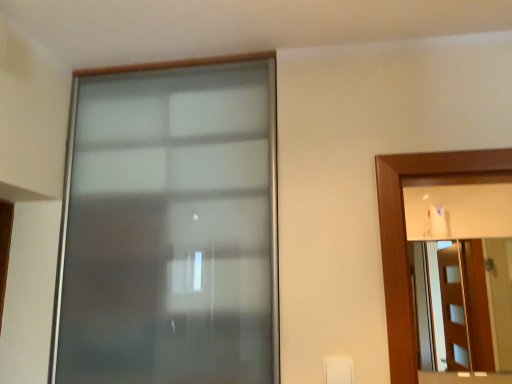
The height and width of the screenshot is (384, 512). Describe the element at coordinates (464, 269) in the screenshot. I see `frosted glass mirror at right` at that location.

What is the approximate height of frosted glass mirror at right?

25.23 inches.

Image resolution: width=512 pixels, height=384 pixels. In order to click on frosted glass mirror at right in this screenshot , I will do `click(464, 269)`.

Image resolution: width=512 pixels, height=384 pixels. Describe the element at coordinates (170, 226) in the screenshot. I see `frosted glass window at center` at that location.

Identify the location of frosted glass window at center. (170, 226).

Where is `frosted glass mirror at right`? The width and height of the screenshot is (512, 384). frosted glass mirror at right is located at coordinates [x=464, y=269].

Considering the relative positions of frosted glass mirror at right and frosted glass window at center in the image provided, is frosted glass mirror at right to the left of frosted glass window at center from the viewer's perspective?

No, frosted glass mirror at right is not to the left of frosted glass window at center.

Based on the photo, does frosted glass mirror at right lie in front of frosted glass window at center?

No, the depth of frosted glass mirror at right is greater than that of frosted glass window at center.

Is point (490, 257) closer to camera compared to point (236, 346)?

No, (490, 257) is further to viewer.

From the image's perspective, is frosted glass mirror at right under frosted glass window at center?

Yes.

From a real-world perspective, which is physically above, frosted glass mirror at right or frosted glass window at center?

frosted glass window at center, from a real-world perspective.

From the picture: Can you confirm if frosted glass mirror at right is thinner than frosted glass window at center?

No.

Is frosted glass mirror at right taller or shorter than frosted glass window at center?

Considering their sizes, frosted glass mirror at right has less height than frosted glass window at center.

Between frosted glass mirror at right and frosted glass window at center, which one has smaller size?

With smaller size is frosted glass mirror at right.

Is frosted glass mirror at right surrounding frosted glass window at center?

No, frosted glass window at center is not inside frosted glass mirror at right.

Are frosted glass mirror at right and frosted glass window at center far apart?

Indeed, frosted glass mirror at right is not near frosted glass window at center.

Is frosted glass mirror at right positioned with its back to frosted glass window at center?

No, frosted glass window at center is not at the back of frosted glass mirror at right.

In the scene shown: How many degrees apart are the facing directions of frosted glass mirror at right and frosted glass window at center?

0.000586 degrees separate the facing orientations of frosted glass mirror at right and frosted glass window at center.

How far apart are frosted glass mirror at right and frosted glass window at center?

They are 7.72 feet apart.

Image resolution: width=512 pixels, height=384 pixels. In order to click on mirror lying on the right of frosted glass window at center in this screenshot , I will do `click(464, 269)`.

Is frosted glass window at center at the right side of frosted glass mirror at right?

Incorrect, frosted glass window at center is not on the right side of frosted glass mirror at right.

Is frosted glass window at center positioned behind frosted glass mirror at right?

No, it is not.

Is point (246, 228) positioned in front of point (416, 286)?

Yes, point (246, 228) is in front of point (416, 286).

From the image's perspective, is frosted glass window at center located above frosted glass mirror at right?

Yes, from the image's perspective, frosted glass window at center is over frosted glass mirror at right.

From a real-world perspective, is frosted glass window at center beneath frosted glass mirror at right?

No, from a real-world perspective, frosted glass window at center is not below frosted glass mirror at right.

Which of these two, frosted glass window at center or frosted glass mirror at right, is wider?

With larger width is frosted glass mirror at right.

Between frosted glass window at center and frosted glass mirror at right, which one has more height?

With more height is frosted glass window at center.

Considering the sizes of objects frosted glass window at center and frosted glass mirror at right in the image provided, who is smaller, frosted glass window at center or frosted glass mirror at right?

With smaller size is frosted glass mirror at right.

Would you say frosted glass window at center is outside frosted glass mirror at right?

Yes, frosted glass window at center is located beyond the bounds of frosted glass mirror at right.

Is frosted glass window at center placed right next to frosted glass mirror at right?

No, frosted glass window at center is not beside frosted glass mirror at right.

Could you tell me if frosted glass window at center is facing frosted glass mirror at right?

No, frosted glass window at center is not oriented towards frosted glass mirror at right.

How distant is frosted glass window at center from frosted glass mirror at right?

frosted glass window at center is 2.35 meters away from frosted glass mirror at right.

Locate an element on the screen. Image resolution: width=512 pixels, height=384 pixels. mirror below the frosted glass window at center (from a real-world perspective) is located at coordinates coord(464,269).

Image resolution: width=512 pixels, height=384 pixels. I want to click on window lying in front of the frosted glass mirror at right, so click(170, 226).

You are a GUI agent. You are given a task and a screenshot of the screen. Output one action in this format:
    pyautogui.click(x=<x>, y=<y>)
    Task: Click on the mirror below the frosted glass window at center (from the image's perspective)
    
    Given the screenshot: What is the action you would take?
    pyautogui.click(x=464, y=269)